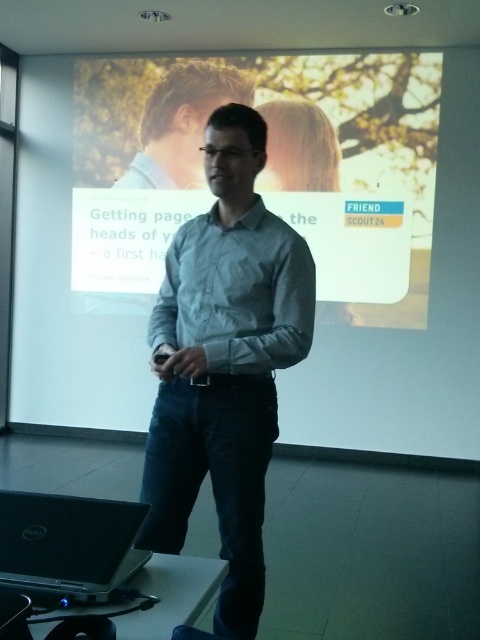
You are organizing a presentation and need to adjust the slide layout. The slide currently shows the light blue shirt at center and the light brown hair at center. Which object should you resize to ensure they are the same width without overlapping? Explain your reasoning.

The light blue shirt at center has a lesser width compared to light brown hair at center. To make them the same width without overlapping, you should increase the width of the light blue shirt at center to match the width of the light brown hair at center.

What is the position of the black matte laptop at lower left relative to the light brown hair at center?

The black matte laptop at lower left is to the right of the light brown hair at center according to the description.

You are a robot with a 2.5 meter arm. You need to pick up the black matte laptop at lower left and place it near the light brown hair at center. Can your arm reach that far?

The distance between the black matte laptop at lower left and the light brown hair at center is 4.10 meters. Since your arm is only 2.5 meters long, you cannot reach that far.